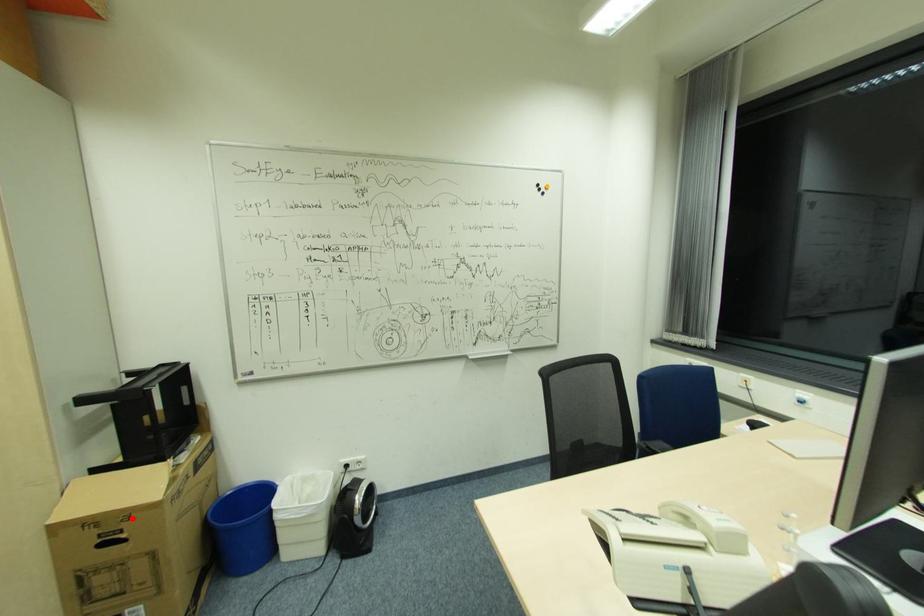
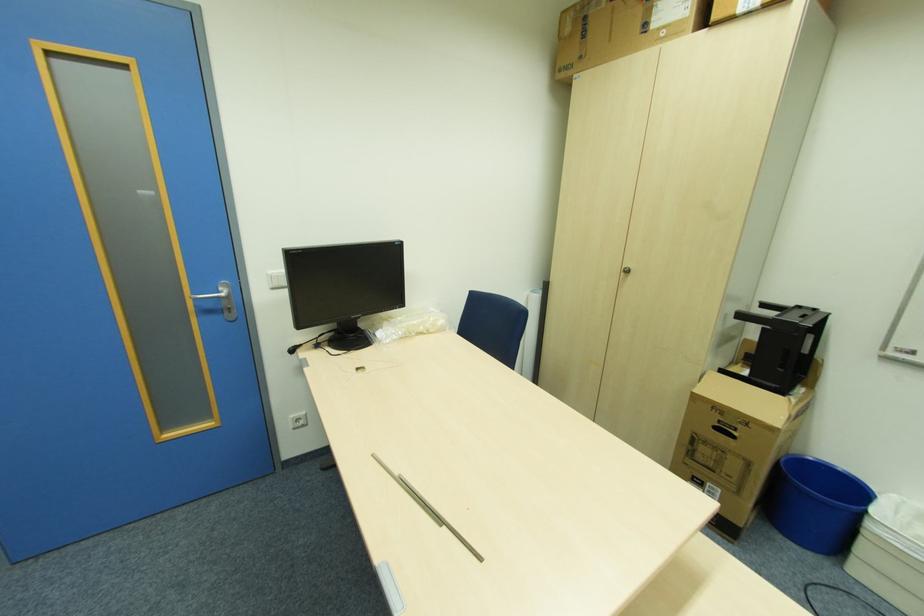
Question: A red point is marked in image1. In image2, is the corresponding 3D point closer to the camera or farther? Reply with the corresponding letter.

Choices:
 (A) The corresponding 3D point is closer.
 (B) The corresponding 3D point is farther.

Answer: (B)